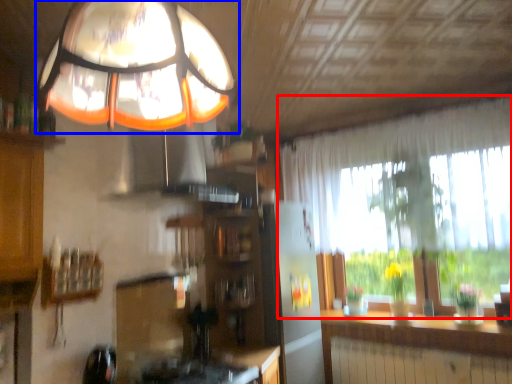
Question: Among these objects, which one is nearest to the camera, window (highlighted by a red box) or lamp (highlighted by a blue box)?

Choices:
 (A) window
 (B) lamp

Answer: (B)